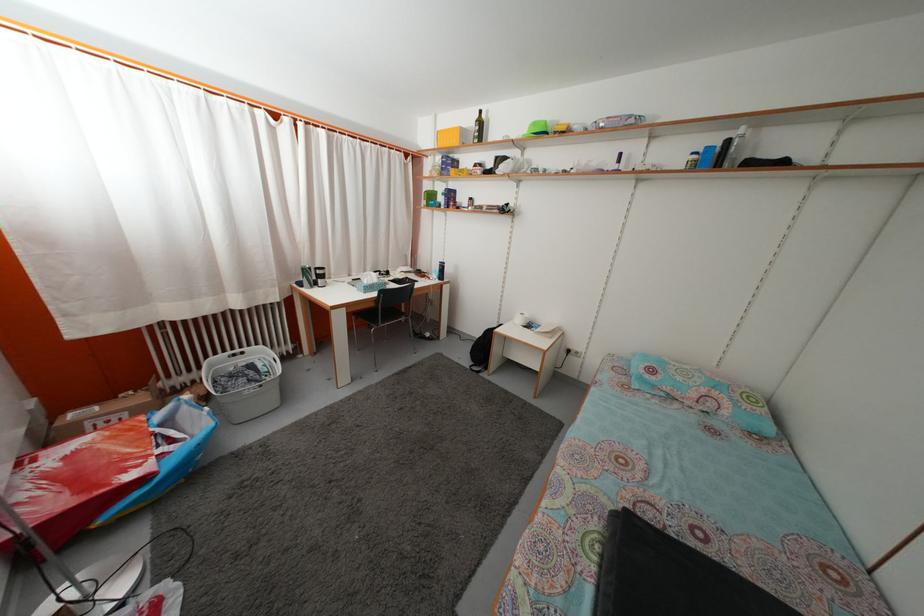
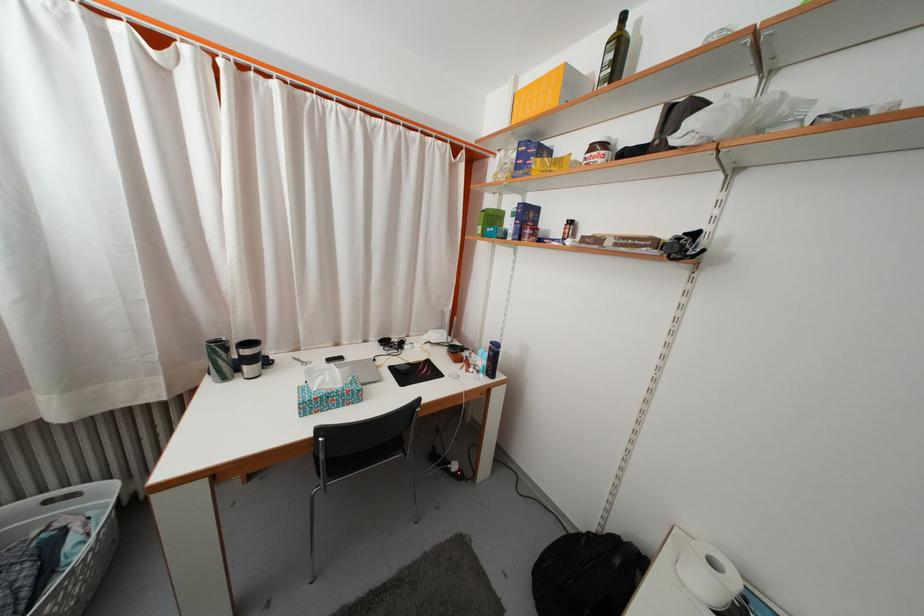
Where in the second image is the point corresponding to the point at 468,139 from the first image?

(575, 84)